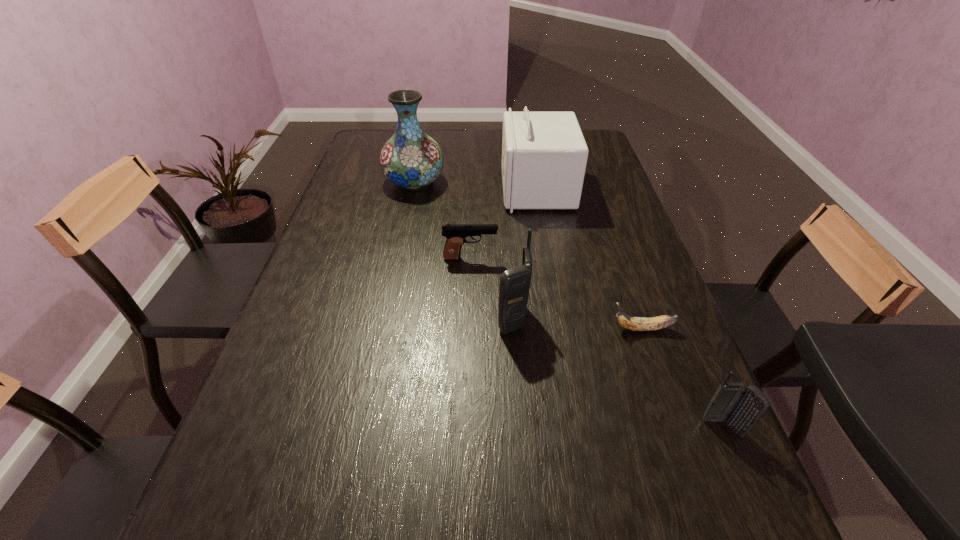
Locate an element on the screen. Image resolution: width=960 pixels, height=540 pixels. vacant point located between the shortest object and the taller cellular telephone is located at coordinates (577, 324).

This screenshot has height=540, width=960. Identify the location of free area in between the third farthest object and the taller cellular telephone. (492, 288).

Identify the location of unoccupied area between the first-aid kit and the leftmost object. The image size is (960, 540). (475, 186).

This screenshot has height=540, width=960. What are the coordinates of `empty space between the pistol and the banana` in the screenshot? It's located at (556, 293).

The height and width of the screenshot is (540, 960). Find the location of `free area in between the right cellular telephone and the pistol`. free area in between the right cellular telephone and the pistol is located at coordinates (596, 343).

The image size is (960, 540). I want to click on free space between the farther cellular telephone and the fifth tallest object, so click(x=492, y=288).

The height and width of the screenshot is (540, 960). In order to click on free space between the third farthest object and the first-aid kit in this screenshot , I will do `click(504, 224)`.

Locate an element on the screen. This screenshot has width=960, height=540. object identified as the fifth closest to the shortest object is located at coordinates (411, 159).

This screenshot has height=540, width=960. Find the location of `the second closest object to the right cellular telephone`. the second closest object to the right cellular telephone is located at coordinates (514, 288).